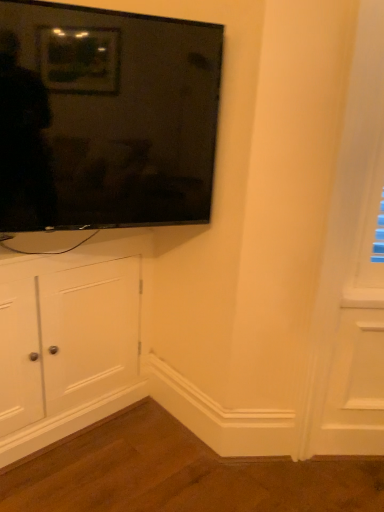
What are the coordinates of `vacant area on top of flat screen tv at upper left (from a real-world perspective)` in the screenshot? It's located at (142, 8).